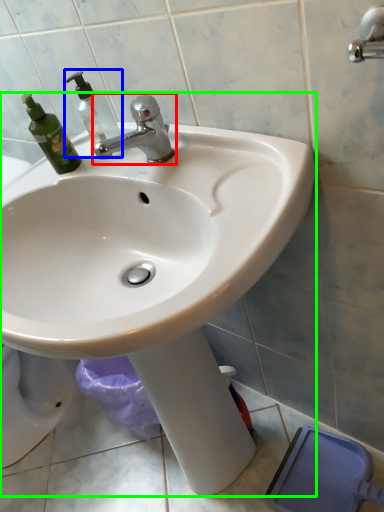
Question: Which object is positioned closest to tap (highlighted by a red box)? Select from soap dispenser (highlighted by a blue box) and sink (highlighted by a green box).

Choices:
 (A) soap dispenser
 (B) sink

Answer: (A)